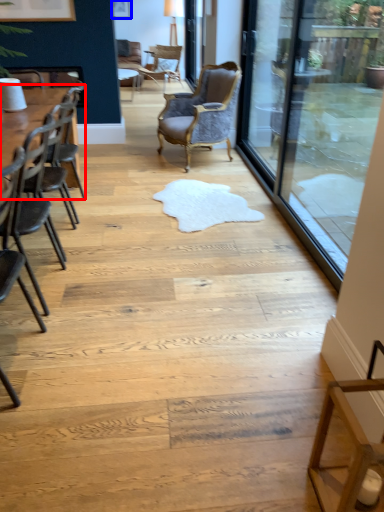
Question: Which object appears closest to the camera in this image, table (highlighted by a red box) or picture frame (highlighted by a blue box)?

Choices:
 (A) table
 (B) picture frame

Answer: (A)